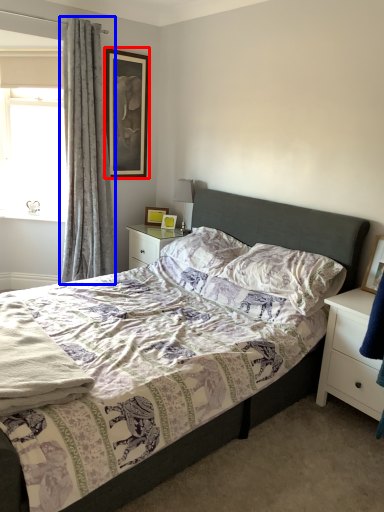
Question: Which point is closer to the camera, picture frame (highlighted by a red box) or curtain (highlighted by a blue box)?

Choices:
 (A) picture frame
 (B) curtain

Answer: (B)